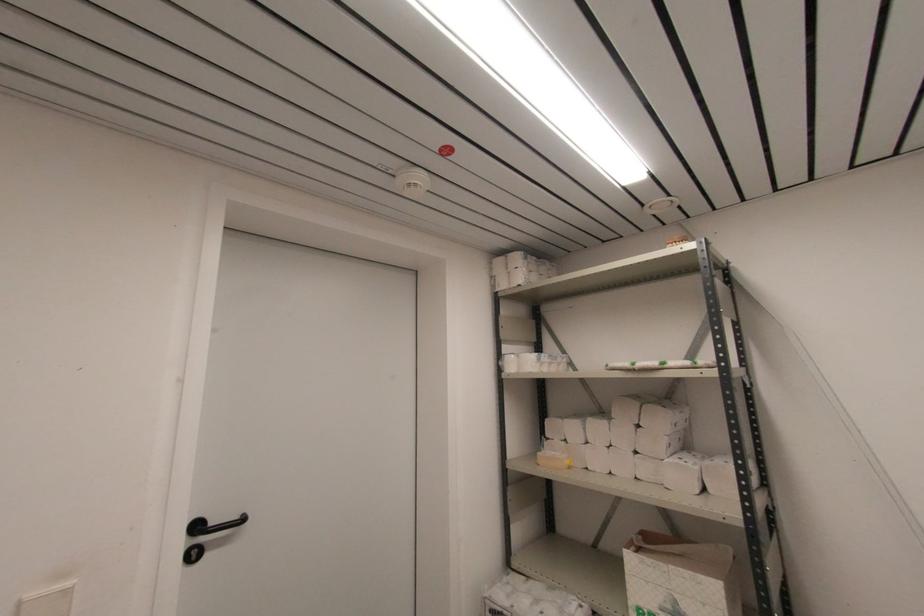
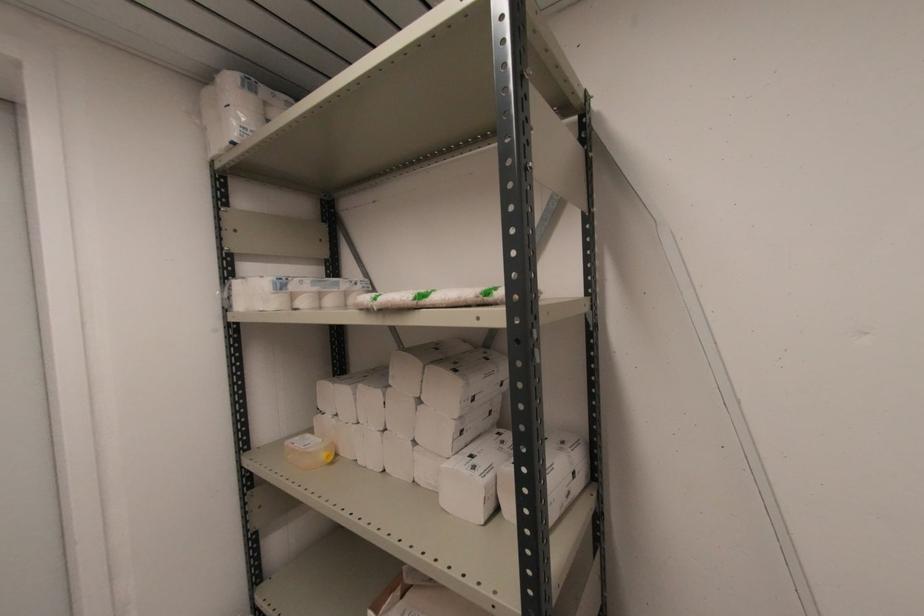
Question: The camera is either moving clockwise (left) or counter-clockwise (right) around the object. The first image is from the beginning of the video and the second image is from the end. Is the camera moving left or right when shooting the video?

Choices:
 (A) Left
 (B) Right

Answer: (A)